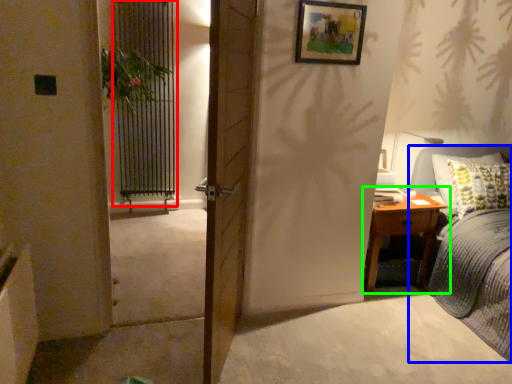
Question: Which object is the closest to the screen door (highlighted by a red box)? Choose among these: bed (highlighted by a blue box) or nightstand (highlighted by a green box).

Choices:
 (A) bed
 (B) nightstand

Answer: (B)